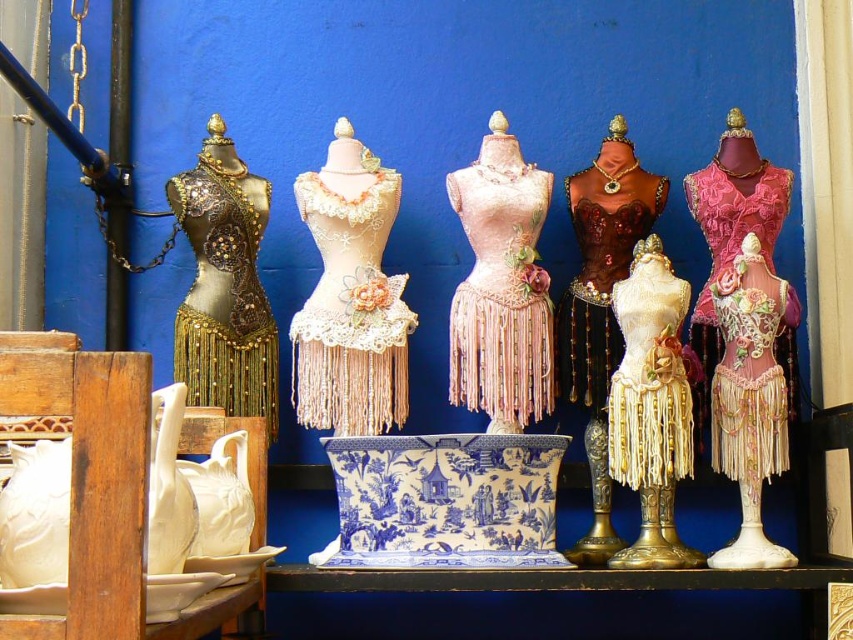
You are a fashion designer observing the mannequins. You notice two dresses at the center of the image labeled as the pink lace dress at center and the lace fabric dress at center. Which dress is positioned lower in the display?

The pink lace dress at center is below the lace fabric dress at center, so the pink lace dress at center is positioned lower in the display.

Based on the photo, you are standing in front of the mannequins displayed against the vibrant blue wall. You notice a point marked at coordinate (651, 406). Which mannequin does this coordinate correspond to?

The point at coordinate (651, 406) corresponds to the gold fringed dress form at center.

You are an interior designer planning to place a new sofa in the living room. You have two dress forms in the scene, the gold fringed dress form at center and the pink lace dress at right. Which dress form requires more space due to its size?

The gold fringed dress form at center is larger in size than the pink lace dress at right, so it requires more space.